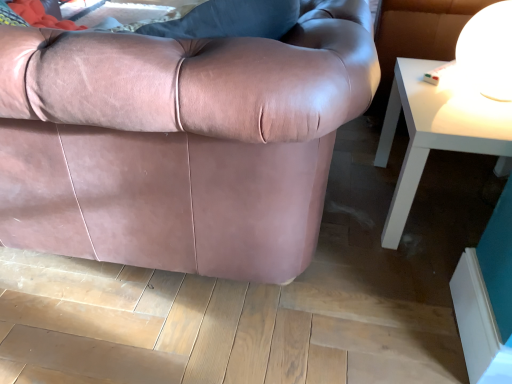
Question: Could you tell me if white glossy table at upper right is turned towards white glossy table lamp at upper right?

Choices:
 (A) yes
 (B) no

Answer: (B)

Question: Is white glossy table at upper right taller than white glossy table lamp at upper right?

Choices:
 (A) no
 (B) yes

Answer: (B)

Question: Can you confirm if white glossy table at upper right is thinner than white glossy table lamp at upper right?

Choices:
 (A) yes
 (B) no

Answer: (B)

Question: From a real-world perspective, is white glossy table at upper right physically below white glossy table lamp at upper right?

Choices:
 (A) yes
 (B) no

Answer: (A)

Question: Is white glossy table at upper right not inside white glossy table lamp at upper right?

Choices:
 (A) no
 (B) yes

Answer: (B)

Question: From the image's perspective, would you say white glossy table at upper right is positioned over white glossy table lamp at upper right?

Choices:
 (A) no
 (B) yes

Answer: (A)

Question: Does white glossy table at upper right come behind matte pink leather couch at center?

Choices:
 (A) yes
 (B) no

Answer: (A)

Question: Is white glossy table at upper right oriented towards matte pink leather couch at center?

Choices:
 (A) no
 (B) yes

Answer: (A)

Question: Is white glossy table at upper right positioned with its back to matte pink leather couch at center?

Choices:
 (A) yes
 (B) no

Answer: (B)

Question: Does white glossy table at upper right have a greater height compared to matte pink leather couch at center?

Choices:
 (A) no
 (B) yes

Answer: (A)

Question: Considering the relative sizes of white glossy table at upper right and matte pink leather couch at center in the image provided, is white glossy table at upper right smaller than matte pink leather couch at center?

Choices:
 (A) yes
 (B) no

Answer: (A)

Question: Is white glossy table at upper right to the left of matte pink leather couch at center from the viewer's perspective?

Choices:
 (A) yes
 (B) no

Answer: (B)

Question: Can you confirm if white glossy table lamp at upper right is smaller than matte pink leather couch at center?

Choices:
 (A) yes
 (B) no

Answer: (A)